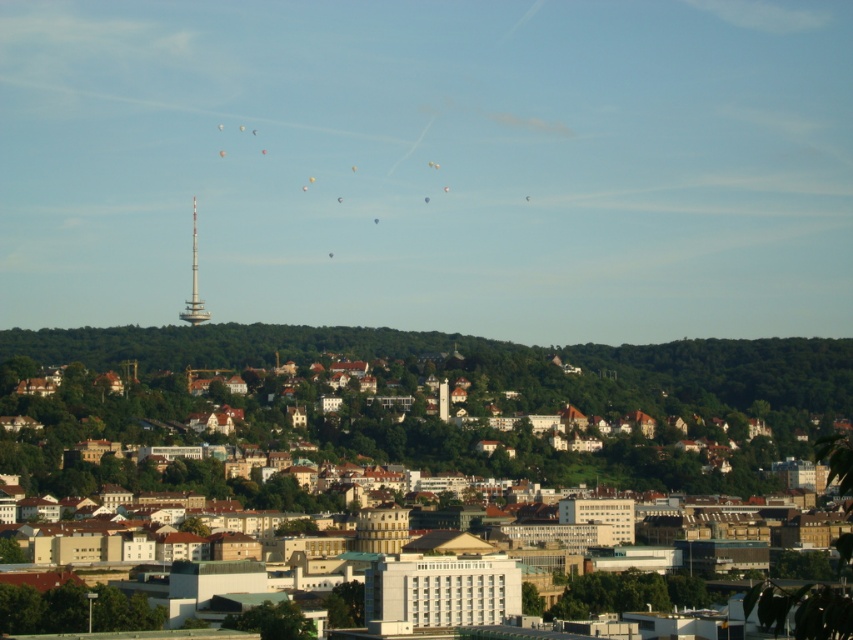
Question: Which point appears farthest from the camera in this image?

Choices:
 (A) (850, 413)
 (B) (194, 291)

Answer: (A)

Question: Which point appears farthest from the camera in this image?

Choices:
 (A) (206, 312)
 (B) (253, 465)

Answer: (A)

Question: Can you confirm if white matte building at center is bigger than silver metallic tower at center?

Choices:
 (A) no
 (B) yes

Answer: (B)

Question: Which point is closer to the camera taking this photo?

Choices:
 (A) (173, 474)
 (B) (195, 317)

Answer: (B)

Question: In this image, where is white matte building at center located relative to silver metallic tower at center?

Choices:
 (A) below
 (B) above

Answer: (A)

Question: Does white matte building at center come in front of silver metallic tower at center?

Choices:
 (A) no
 (B) yes

Answer: (B)